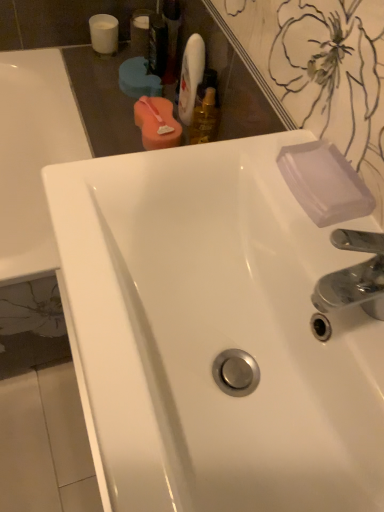
Question: In terms of width, does translucent plastic mouthwash at upper center, placed as the 5th mouthwash when sorted from left to right, look wider or thinner when compared to transparent plastic soap at upper right?

Choices:
 (A) thin
 (B) wide

Answer: (A)

Question: Is translucent plastic mouthwash at upper center, placed as the 5th mouthwash when sorted from left to right, situated inside transparent plastic soap at upper right or outside?

Choices:
 (A) inside
 (B) outside

Answer: (B)

Question: Which object is positioned farthest from the pink sponge at upper center, marked as the third mouthwash in a right-to-left arrangement?

Choices:
 (A) clear plastic bottle at upper center, which is counted as the fifth mouthwash, starting from the right
 (B) white glossy sink at center
 (C) gold metallic mouthwash at upper center, which is the 1th mouthwash from right to left
 (D) translucent plastic mouthwash at upper center, the second mouthwash from the right
 (E) transparent plastic soap at upper right

Answer: (B)

Question: Which object is the farthest from the white glossy sink at center?

Choices:
 (A) translucent plastic mouthwash at upper center, the second mouthwash from the right
 (B) gold metallic mouthwash at upper center, which is the 1th mouthwash from right to left
 (C) transparent plastic mouthwash at upper center, arranged as the 4th mouthwash when viewed from the right
 (D) transparent plastic soap at upper right
 (E) pink sponge at upper center, marked as the third mouthwash in a right-to-left arrangement

Answer: (C)